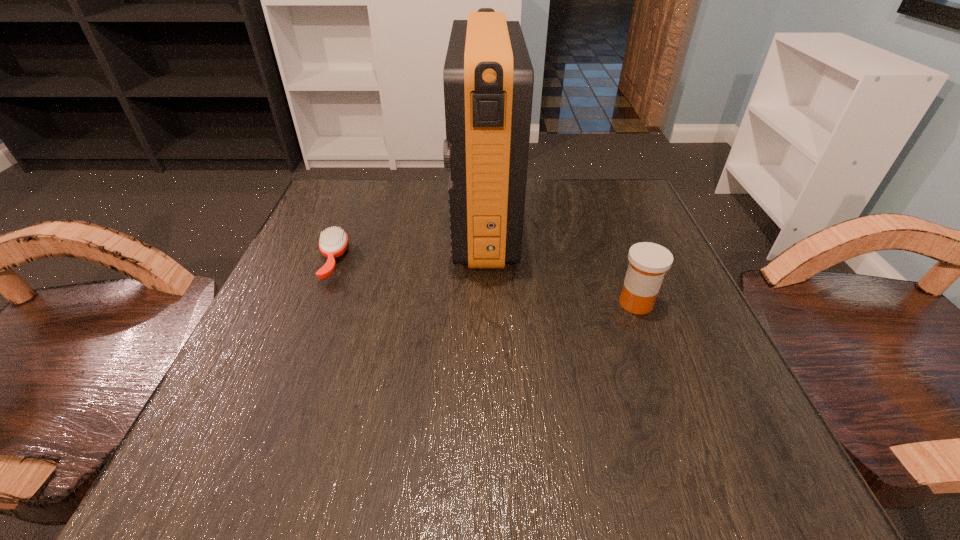
The height and width of the screenshot is (540, 960). Identify the location of empty space that is in between the nearest object and the radio receiver. (560, 263).

Identify the location of free space that is in between the nearest object and the hairbrush. This screenshot has width=960, height=540. (484, 282).

Locate which object ranks in proximity to the rightmost object. Please provide its 2D coordinates. Your answer should be formatted as a tuple, i.e. [(x, y)], where the tuple contains the x and y coordinates of a point satisfying the conditions above.

[(488, 77)]

Where is `object that stands as the second closest to the hairbrush`? object that stands as the second closest to the hairbrush is located at coordinates (648, 262).

This screenshot has height=540, width=960. I want to click on vacant position in the image that satisfies the following two spatial constraints: 1. on the front-facing side of the tallest object; 2. on the front side of the hairbrush, so click(485, 260).